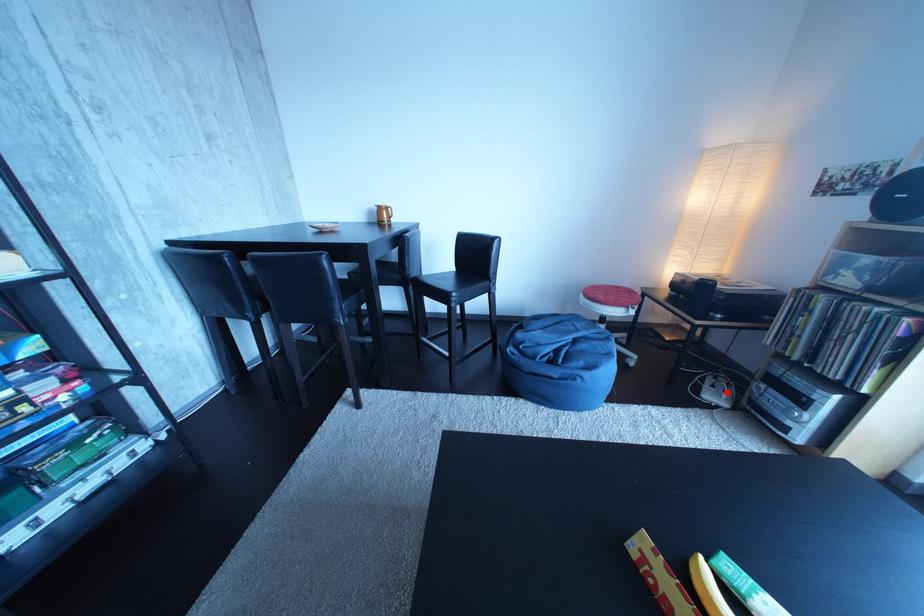
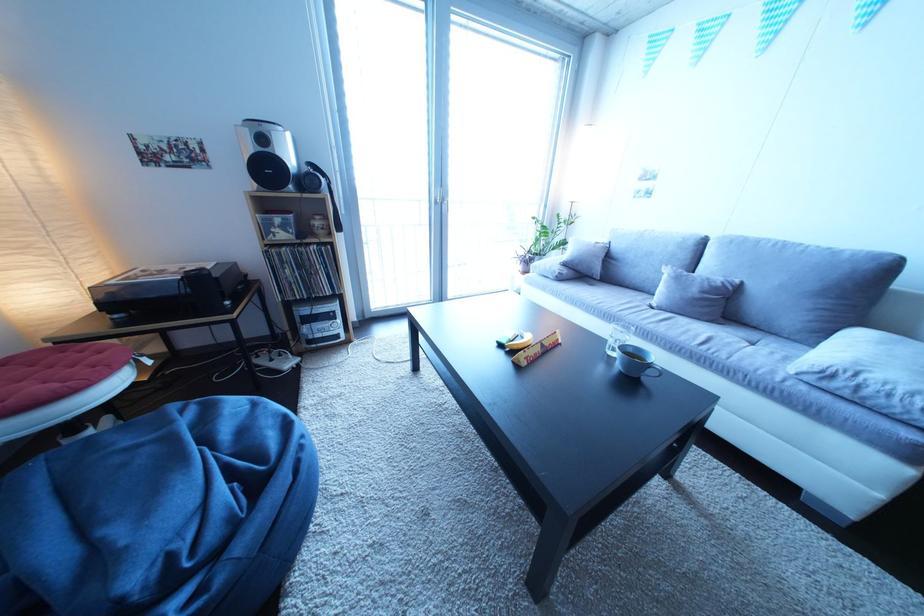
In the second image, find the point that corresponds to the highlighted location in the first image.

(285, 366)